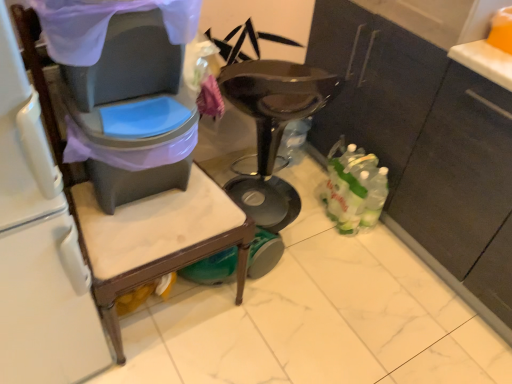
Image resolution: width=512 pixels, height=384 pixels. What do you see at coordinates (430, 132) in the screenshot?
I see `matte black cabinet at lower right` at bounding box center [430, 132].

Locate an element on the screen. matte black cabinet at lower right is located at coordinates (430, 132).

Image resolution: width=512 pixels, height=384 pixels. What are the coordinates of `matte black cabinet at lower right` in the screenshot? It's located at (430, 132).